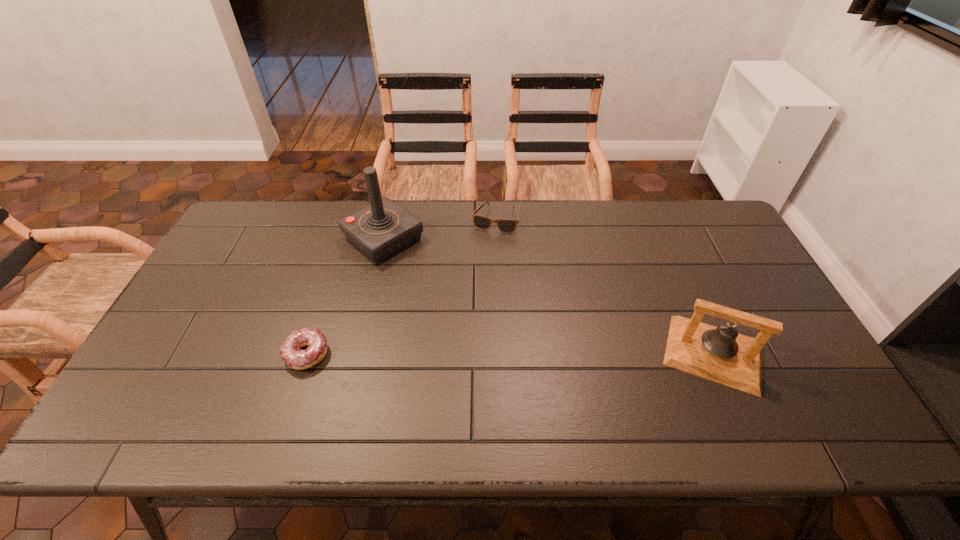
The image size is (960, 540). Find the location of `vacant space on the desktop that is between the doughnut and the third shortest object and is positioned on the frames of the sunglasses`. vacant space on the desktop that is between the doughnut and the third shortest object and is positioned on the frames of the sunglasses is located at coordinates (452, 354).

Image resolution: width=960 pixels, height=540 pixels. I want to click on vacant space on the desktop that is between the doughnut and the third shortest object and is positioned on the rectangular base of the joystick, so coord(528,354).